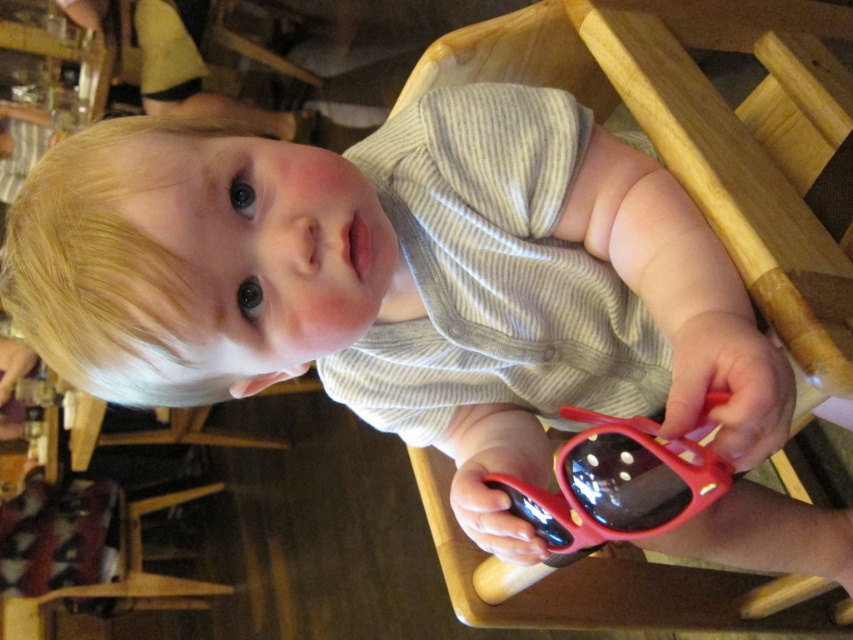
You are a photographer standing 20 inches away from the high chair. You want to take a photo of the child and the red sunglasses. However, you notice a point at coordinate point (693, 157) in the image that is 23.10 inches away from you. Is this point likely part of the child or the high chair?

The distance of point (693, 157) from viewer is 23.10 inches. Since you are standing 20 inches away from the high chair, the point at 23.10 inches is farther than the high chair itself. This suggests it is part of the child, who is sitting on the high chair and thus further away from you compared to the chair base.

You are a photographer trying to capture a candid shot of the child in the wooden chair at center. You are holding a camera that requires a minimum distance of 20 inches to focus properly. Based on the scene, can you take a clear photo from your current position?

The wooden chair at center and camera are 18.98 inches apart from each other. Since the required minimum distance is 20 inches, the camera is too close to take a clear photo. You need to move back about 1.02 inches to achieve proper focus.

You are a photographer setting up for a photo shoot. You have a wooden chair at center and red rubber sunglasses at center in the scene. The client wants to ensure that the sunglasses are the focal point. Based on their sizes, should you place the sunglasses closer to or farther from the camera compared to the wooden chair?

The wooden chair at center is bigger than the red rubber sunglasses at center. To make the sunglasses the focal point, you should place the sunglasses closer to the camera so they appear larger in the frame, balancing their smaller physical size with proximity.